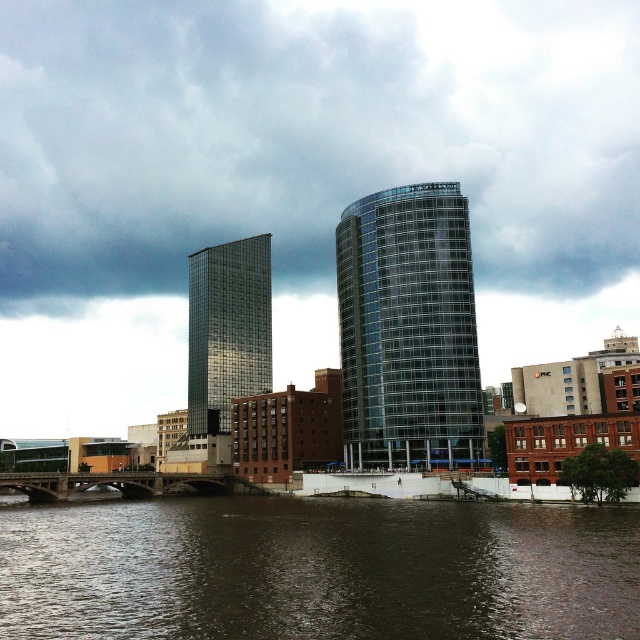
Which is more to the right, cloudy sky at upper center or transparent glass tower at center?

From the viewer's perspective, transparent glass tower at center appears more on the right side.

Which is above, cloudy sky at upper center or transparent glass tower at center?

Positioned higher is cloudy sky at upper center.

You are a GUI agent. You are given a task and a screenshot of the screen. Output one action in this format:
    pyautogui.click(x=<x>, y=<y>)
    Task: Click on the cloudy sky at upper center
    This screenshot has width=640, height=640.
    Given the screenshot: What is the action you would take?
    pyautogui.click(x=310, y=136)

Can you confirm if brown water at lower center is positioned to the left of transparent glass tower at center?

Indeed, brown water at lower center is positioned on the left side of transparent glass tower at center.

Does point (42, 580) come closer to viewer compared to point (371, 214)?

Yes, point (42, 580) is closer to viewer.

Locate an element on the screen. The width and height of the screenshot is (640, 640). brown water at lower center is located at coordinates (317, 570).

Which is above, cloudy sky at upper center or brown water at lower center?

cloudy sky at upper center is above.

Who is more forward, (x=65, y=193) or (x=157, y=531)?

Point (x=157, y=531) is more forward.

Locate an element on the screen. This screenshot has width=640, height=640. cloudy sky at upper center is located at coordinates (310, 136).